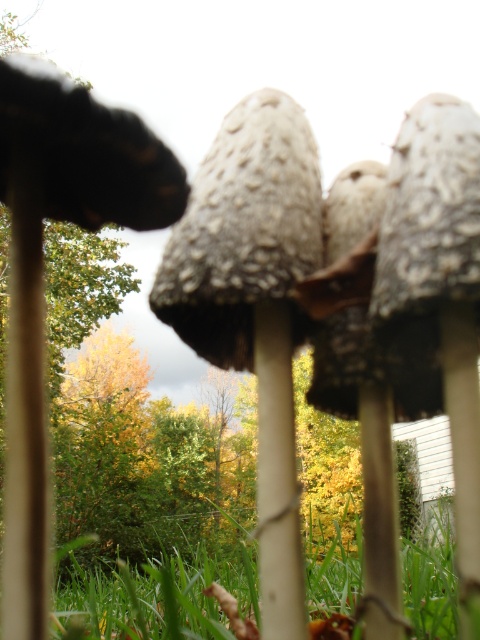
Question: Is green grass at lower center bigger than smooth white stem at center?

Choices:
 (A) no
 (B) yes

Answer: (A)

Question: From the image, what is the correct spatial relationship of brown matte stem at left in relation to white smooth stem at center?

Choices:
 (A) below
 (B) above

Answer: (B)

Question: Is brown matte stem at left behind white smooth stem at center?

Choices:
 (A) yes
 (B) no

Answer: (B)

Question: Which point is farther from the camera taking this photo?

Choices:
 (A) (146, 625)
 (B) (367, 440)
 (C) (36, 208)

Answer: (A)

Question: Which point is closer to the camera?

Choices:
 (A) (384, 428)
 (B) (38, 298)
 (C) (320, 624)
 (D) (285, 358)

Answer: (B)

Question: Considering the real-world distances, which object is farthest from the white smooth stem at center?

Choices:
 (A) green grass at lower center
 (B) brown matte stem at left
 (C) smooth white stem at center

Answer: (A)